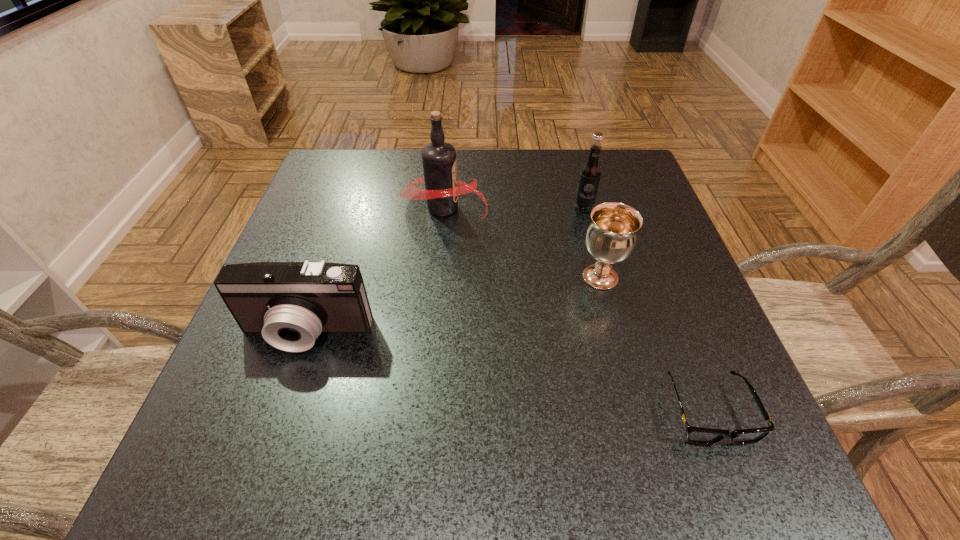
Locate an element on the screen. This screenshot has width=960, height=540. the left root beer is located at coordinates (441, 192).

The image size is (960, 540). Identify the location of the tallest object. (441, 192).

I want to click on the shorter root beer, so click(x=590, y=173).

I want to click on the right root beer, so click(590, 173).

Where is `chalice`? This screenshot has height=540, width=960. chalice is located at coordinates (611, 237).

Image resolution: width=960 pixels, height=540 pixels. What are the coordinates of `the fourth farthest object` in the screenshot? It's located at (290, 303).

Locate an element on the screen. Image resolution: width=960 pixels, height=540 pixels. camcorder is located at coordinates coord(290,303).

At what (x,y) coordinates should I click in order to perform the action: click on the rightmost object. Please return your answer as a coordinate pair (x, y). The width and height of the screenshot is (960, 540). Looking at the image, I should click on (695, 435).

Find the location of a particular element. The height and width of the screenshot is (540, 960). the nearest object is located at coordinates (695, 435).

Find the location of `free region located on the label of the second object from left to right`. free region located on the label of the second object from left to right is located at coordinates tap(645, 207).